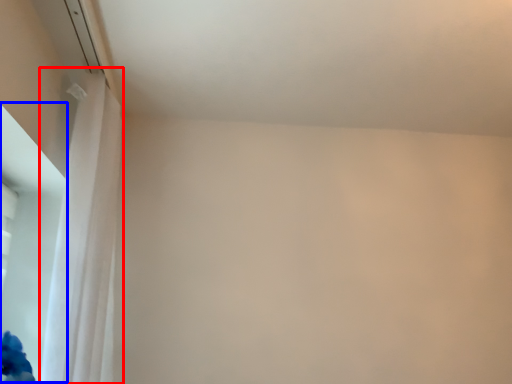
Question: Which object appears closest to the camera in this image, curtain (highlighted by a red box) or window screen (highlighted by a blue box)?

Choices:
 (A) curtain
 (B) window screen

Answer: (A)